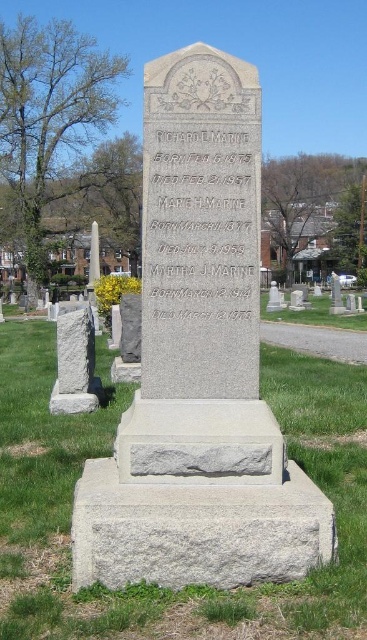
Does gray stone inscription at center appear on the left side of gray stone marker at left?

Incorrect, gray stone inscription at center is not on the left side of gray stone marker at left.

The height and width of the screenshot is (640, 367). In order to click on gray stone inscription at center in this screenshot , I will do `click(201, 227)`.

Can you confirm if gray granite monument at center is positioned to the right of green grass at center?

Indeed, gray granite monument at center is positioned on the right side of green grass at center.

Does gray granite monument at center appear on the left side of green grass at center?

Incorrect, gray granite monument at center is not on the left side of green grass at center.

Find the location of `gray granite monument at center`. gray granite monument at center is located at coordinates (198, 364).

Locate an element on the screen. The image size is (367, 640). gray granite monument at center is located at coordinates (198, 364).

Is point (223, 497) positioned in front of point (63, 380)?

Yes, it is in front of point (63, 380).

Does point (234, 237) come behind point (92, 356)?

No, (234, 237) is in front of (92, 356).

The image size is (367, 640). In order to click on gray granite monument at center in this screenshot , I will do `click(198, 364)`.